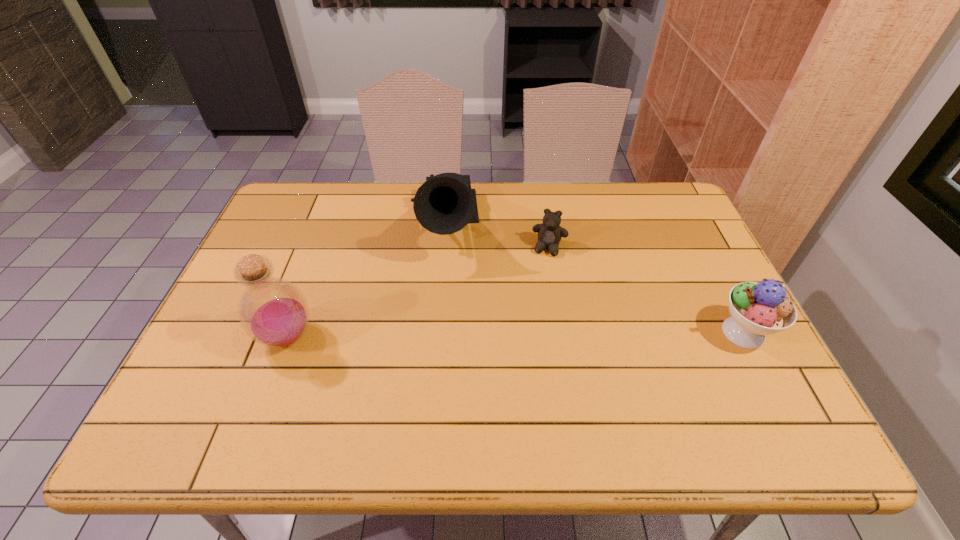
Locate an element on the screen. This screenshot has height=540, width=960. bottle is located at coordinates (274, 312).

Where is `icecream`? This screenshot has height=540, width=960. icecream is located at coordinates (758, 309).

You are a GUI agent. You are given a task and a screenshot of the screen. Output one action in this format:
    pyautogui.click(x=<x>, y=<y>)
    Task: Click on the rightmost object
    The width and height of the screenshot is (960, 540).
    Given the screenshot: What is the action you would take?
    pyautogui.click(x=758, y=309)

Find the location of a particular element. This screenshot has width=960, height=540. the shortest object is located at coordinates (550, 232).

Identify the location of the second object from right to left. Image resolution: width=960 pixels, height=540 pixels. (550, 232).

Find the location of a particular element. This screenshot has height=540, width=960. the third object from right to left is located at coordinates (444, 204).

This screenshot has width=960, height=540. I want to click on vacant region located on the left of the bottle, so click(x=232, y=337).

Where is `free space located on the left of the third tallest object`? free space located on the left of the third tallest object is located at coordinates (621, 333).

This screenshot has height=540, width=960. Identify the location of vacant position located on the face of the second object from right to left. click(x=538, y=295).

This screenshot has width=960, height=540. Identify the location of vacant space located on the face of the second object from right to left. (525, 346).